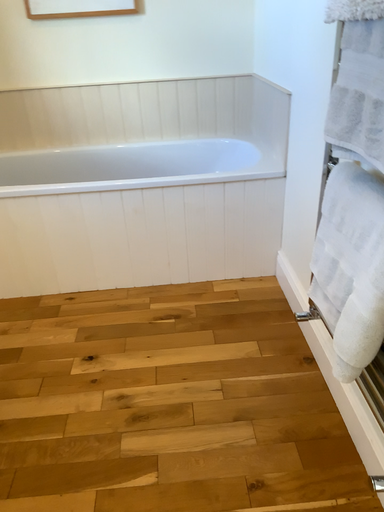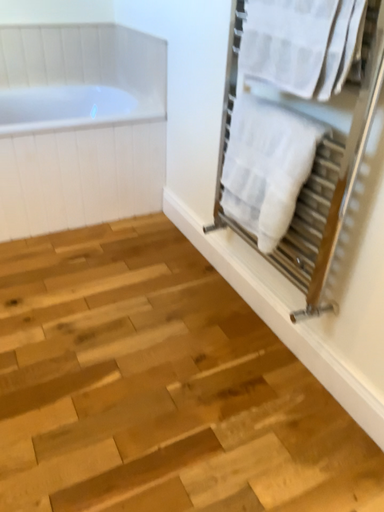
Question: Which way did the camera rotate in the video?

Choices:
 (A) rotated left
 (B) rotated right

Answer: (B)